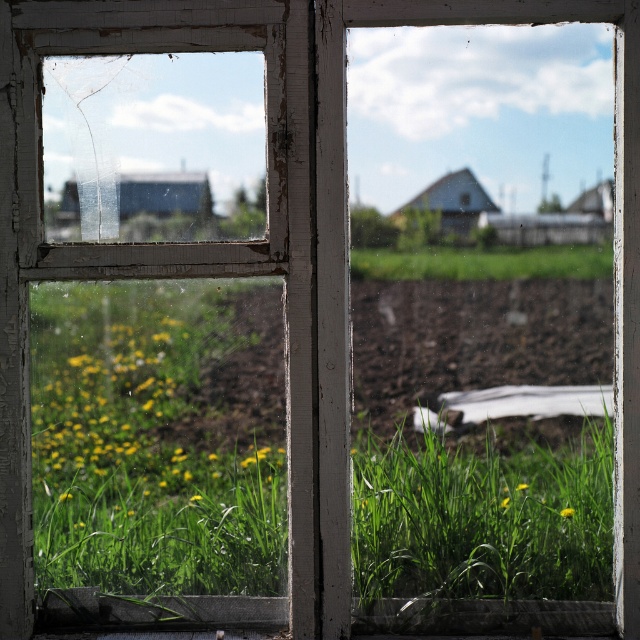
Does smooth concrete sill at lower center lie in front of green grass at center?

That is False.

Who is positioned more to the right, smooth concrete sill at lower center or green grass at center?

green grass at center

Does point (609, 616) come closer to viewer compared to point (589, 260)?

Yes, point (609, 616) is in front of point (589, 260).

What are the coordinates of `smooth concrete sill at lower center` in the screenshot? It's located at (481, 616).